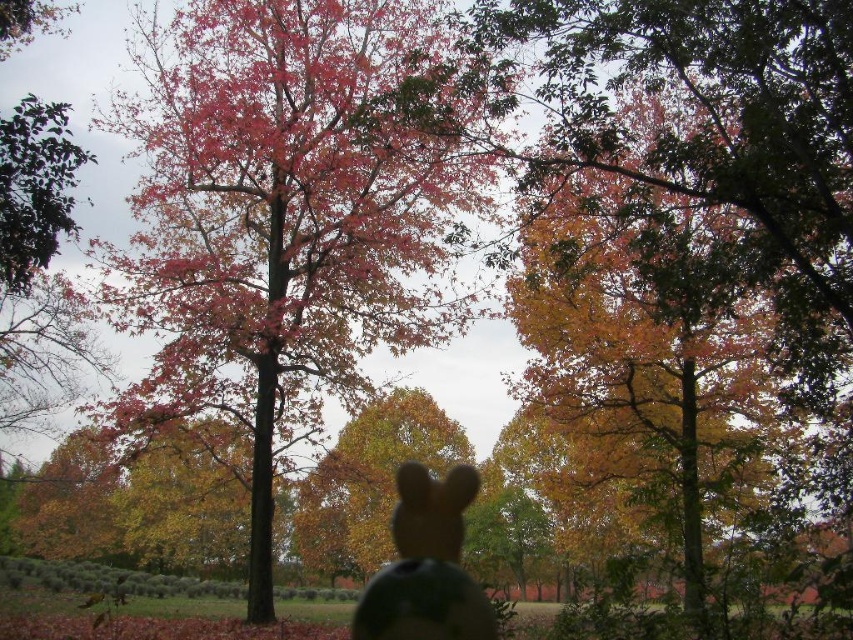
Between yellow-green leaves at center and brown matte plush toy at center, which one has less height?

Standing shorter between the two is brown matte plush toy at center.

Measure the distance between point (767, 220) and camera.

Point (767, 220) and camera are 9.69 meters apart from each other.

I want to click on yellow-green leaves at center, so click(x=712, y=163).